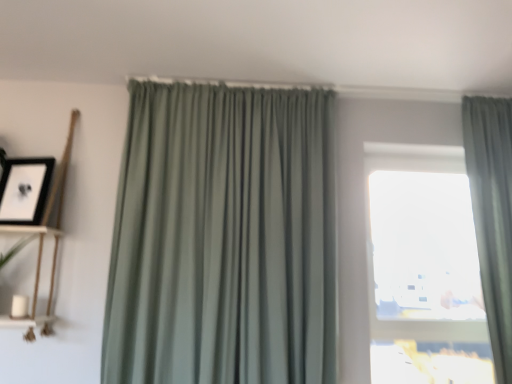
Question: In the image, is white matte shelf at left, placed as the first shelf when sorted from bottom to top, positioned in front of or behind transparent glass window at center?

Choices:
 (A) front
 (B) behind

Answer: (A)

Question: From the image's perspective, is white matte shelf at left, placed as the first shelf when sorted from bottom to top, located above or below transparent glass window at center?

Choices:
 (A) above
 (B) below

Answer: (B)

Question: Based on their relative distances, which object is farther from the transparent glass window at center?

Choices:
 (A) sage green drapery at right, which appears as the first curtain when viewed from the right
 (B) white matte shelf at left, acting as the 2th shelf starting from the top
 (C) black matte picture frame at upper left
 (D) wooden shelf at left, which is the second shelf from bottom to top
 (E) sage green fabric curtain at center, positioned as the 2th curtain in right-to-left order

Answer: (B)

Question: Considering the real-world distances, which object is farthest from the white matte shelf at left, acting as the 2th shelf starting from the top?

Choices:
 (A) wooden shelf at left, which is the second shelf from bottom to top
 (B) transparent glass window at center
 (C) sage green drapery at right, which appears as the first curtain when viewed from the right
 (D) sage green fabric curtain at center, the first curtain when ordered from left to right
 (E) black matte picture frame at upper left

Answer: (C)